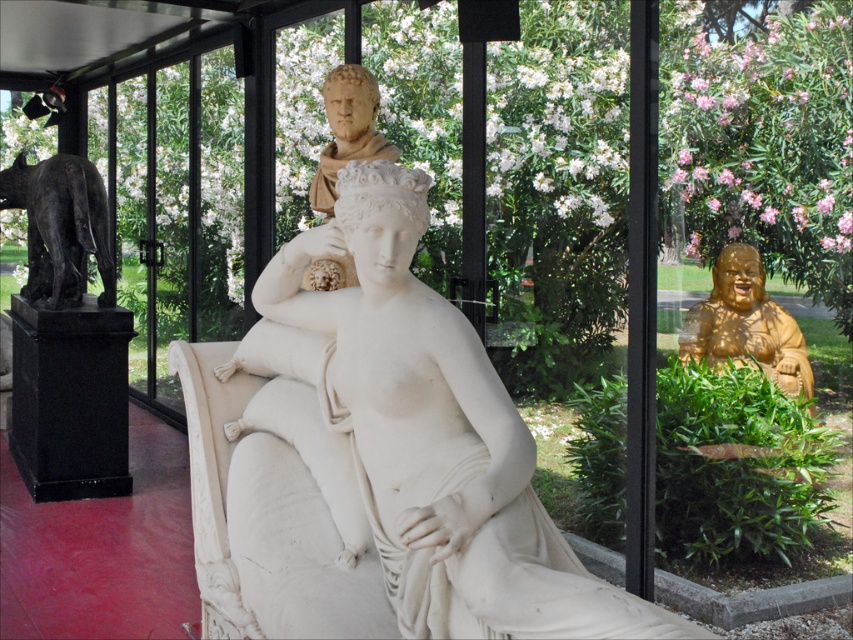
Looking at this image, you are standing at the entrance of the glass structure and want to locate the white marble statue at center. According to the coordinates provided, where should you look?

You should look at point (416,435) to find the white marble statue at center.

Consider the image. You are an art curator planning to move the bronze statue at left closer to the white marble statue at center. Considering their sizes, which one will appear larger when viewed from the same distance?

The white marble statue at center will appear larger because it is taller than the bronze statue at left.